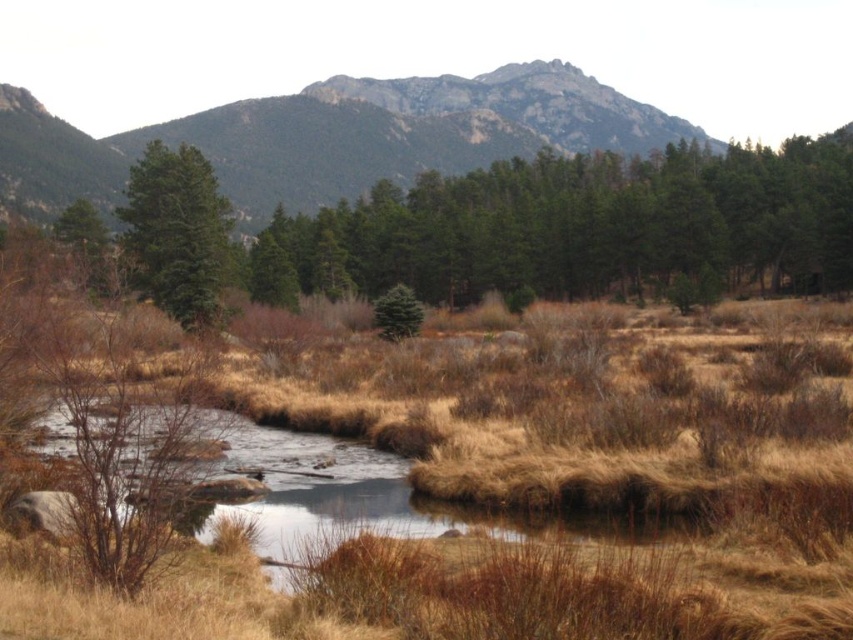
In the scene shown: Which is below, brown dry grass at center or green textured trees at center?

brown dry grass at center

Which is in front, point (461, 529) or point (526, 259)?

Positioned in front is point (461, 529).

Locate an element on the screen. The height and width of the screenshot is (640, 853). brown dry grass at center is located at coordinates (550, 484).

Can you confirm if brown dry grass at center is smaller than green matte tree at left?

Yes, brown dry grass at center is smaller than green matte tree at left.

Between brown dry grass at center and green matte tree at left, which one appears on the right side from the viewer's perspective?

From the viewer's perspective, brown dry grass at center appears more on the right side.

Locate an element on the screen. brown dry grass at center is located at coordinates (550, 484).

Which is behind, point (503, 292) or point (408, 298)?

The point (503, 292) is more distant.

Does green textured trees at center have a lesser height compared to green matte evergreen tree at center?

No.

At what (x,y) coordinates should I click in order to perform the action: click on green textured trees at center. Please return your answer as a coordinate pair (x, y). Looking at the image, I should click on (581, 227).